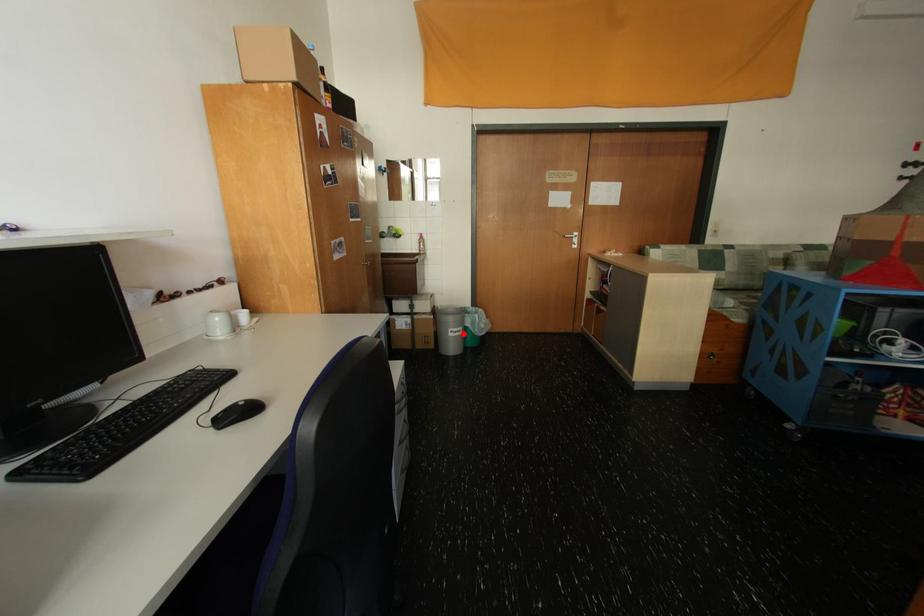
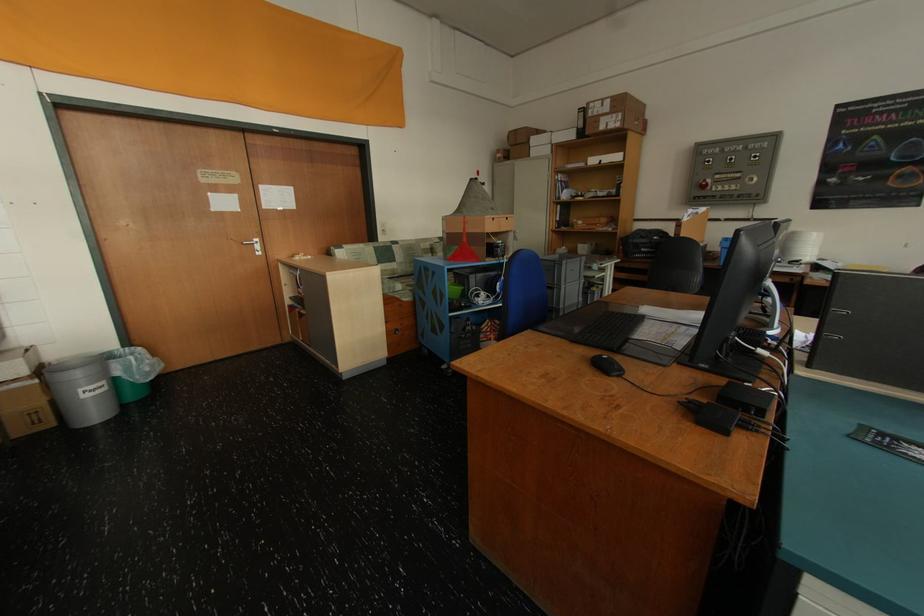
Question: A red point is marked in image1. In image2, is the corresponding 3D point closer to the camera or farther? Reply with the corresponding letter.

Choices:
 (A) The corresponding 3D point is closer.
 (B) The corresponding 3D point is farther.

Answer: (A)